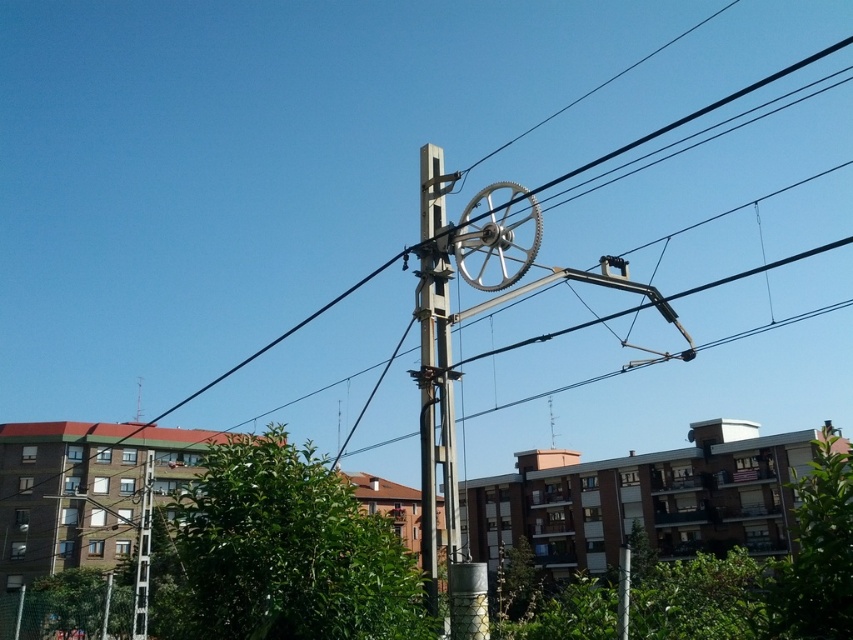
Is metallic gray telegraph pole at center wider than white plastic telegraph pole at left?

No.

Which is more to the left, metallic gray telegraph pole at center or white plastic telegraph pole at left?

Positioned to the left is white plastic telegraph pole at left.

Where is `metallic gray telegraph pole at center`? Image resolution: width=853 pixels, height=640 pixels. metallic gray telegraph pole at center is located at coordinates (434, 369).